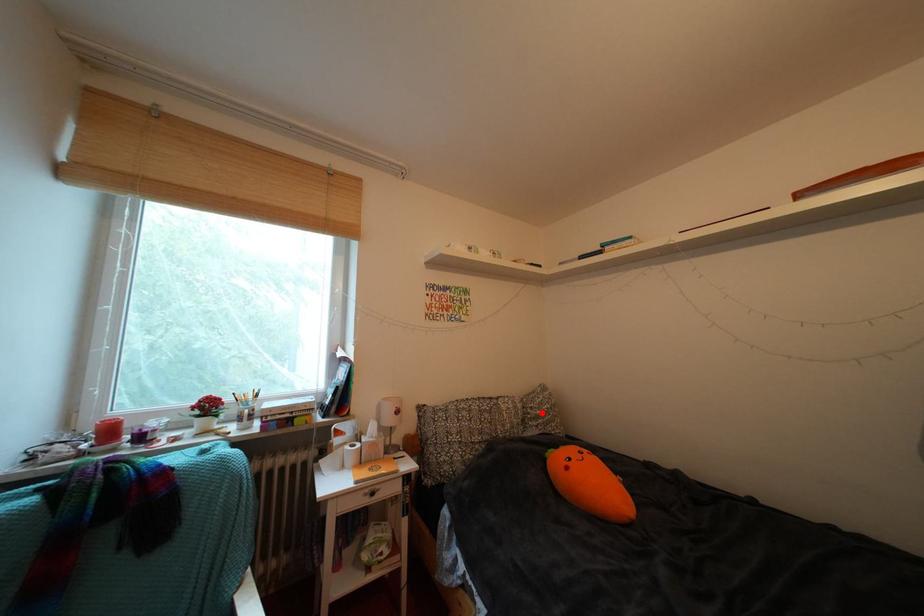
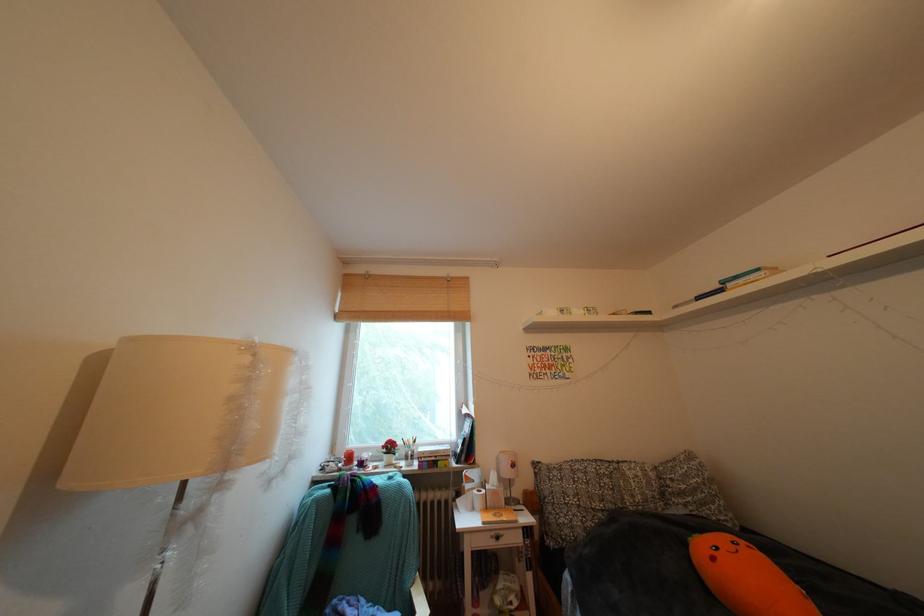
Find the pixel in the second image that matches the highlighted location in the first image.

(682, 485)